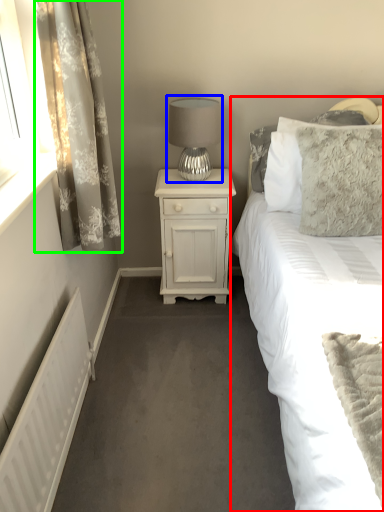
Question: Considering the real-world distances, which object is farthest from bed (highlighted by a red box)? table lamp (highlighted by a blue box) or curtain (highlighted by a green box)?

Choices:
 (A) table lamp
 (B) curtain

Answer: (B)